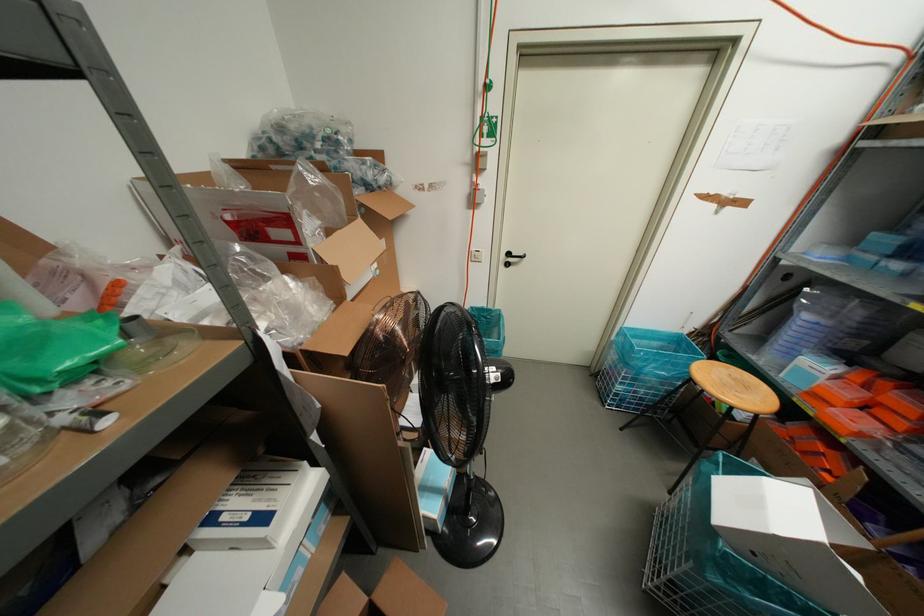
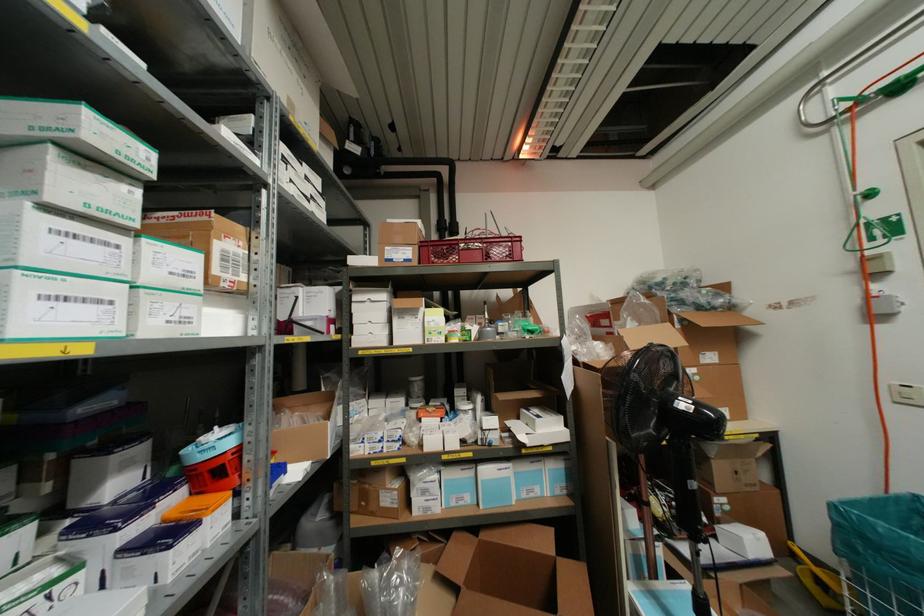
The point at (429, 484) is marked in the first image. Where is the corresponding point in the second image?

(663, 601)